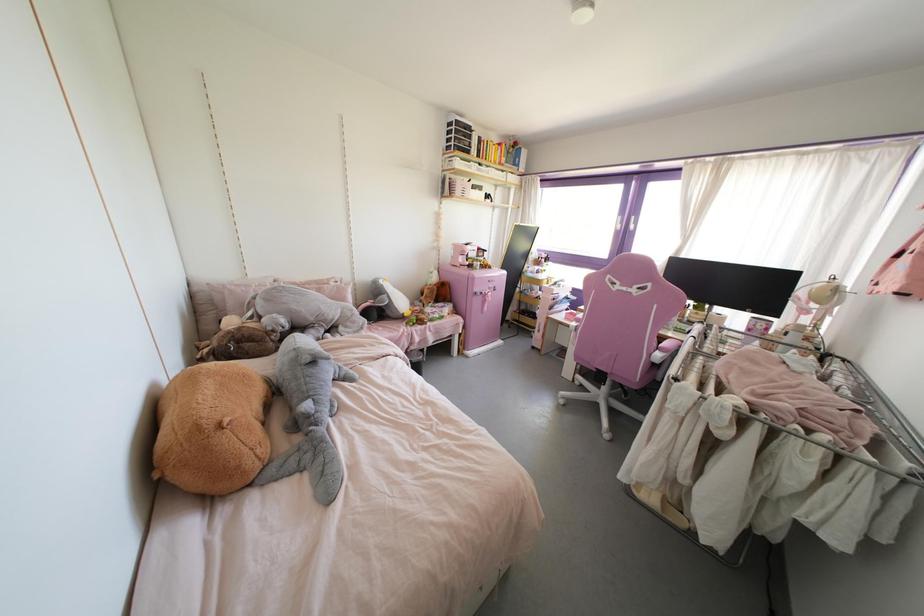
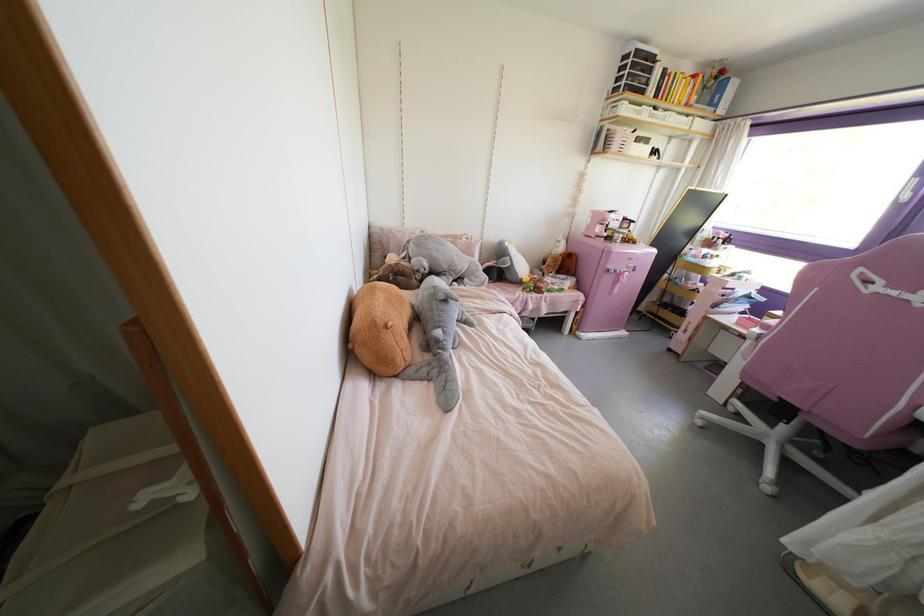
In the second image, find the point that corresponds to point (225, 419) in the first image.

(390, 323)